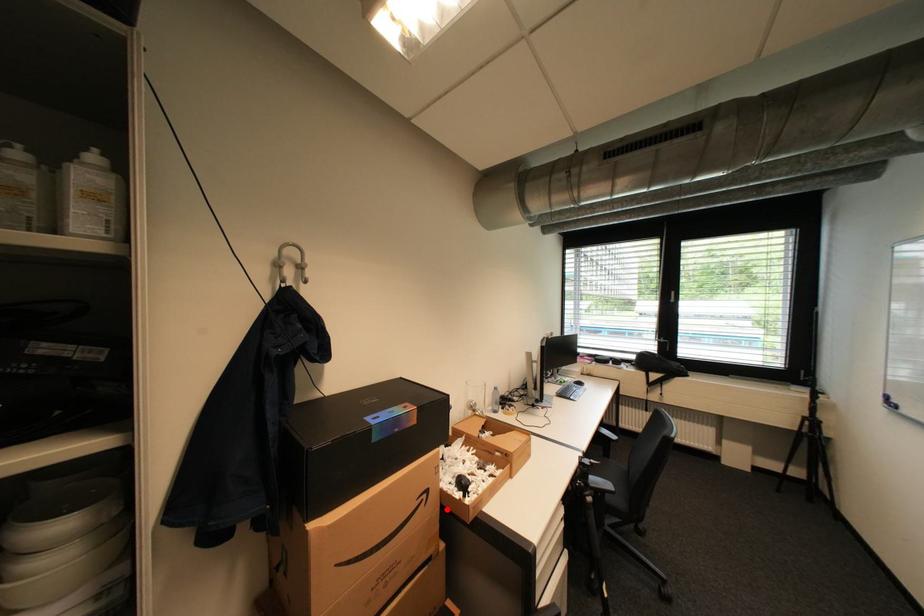
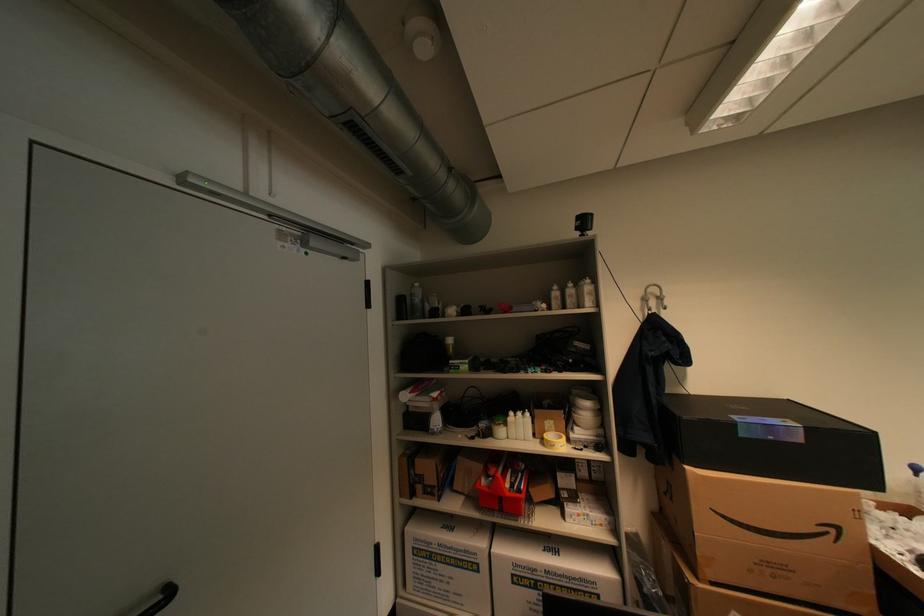
In the second image, find the point that corresponds to the highlighted location in the first image.

(879, 568)